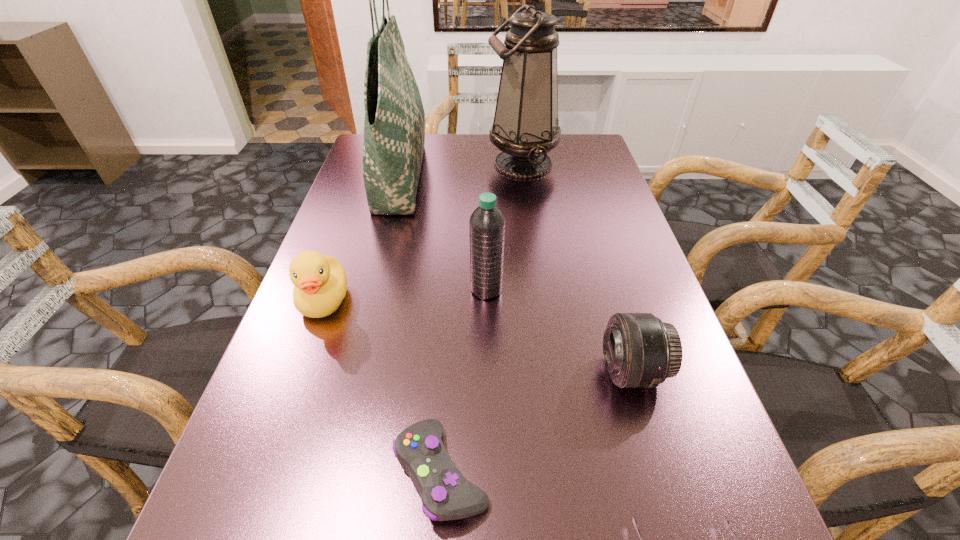
Identify the location of the tallest object. This screenshot has width=960, height=540. (394, 128).

Locate an element on the screen. The height and width of the screenshot is (540, 960). the sixth shortest object is located at coordinates (525, 128).

This screenshot has height=540, width=960. What are the coordinates of `water bottle` in the screenshot? It's located at (487, 223).

Identify the location of duck. Image resolution: width=960 pixels, height=540 pixels. (320, 281).

Where is `telephoto lens`? This screenshot has width=960, height=540. telephoto lens is located at coordinates (640, 351).

You are a GUI agent. You are given a task and a screenshot of the screen. Output one action in this format:
    pyautogui.click(x=<x>, y=<y>)
    Task: Click on the control
    
    Given the screenshot: What is the action you would take?
    pyautogui.click(x=446, y=494)

Locate an element on the screen. The image size is (960, 540). vacant space situated 0.270m on the right of the tote bag is located at coordinates (520, 174).

The image size is (960, 540). I want to click on free space located 0.300m on the left of the oil lamp, so click(385, 164).

Locate an element on the screen. The image size is (960, 540). blank space located 0.200m on the front of the water bottle is located at coordinates (488, 386).

Find the location of a particular element. free spot located 0.170m at the beak of the duck is located at coordinates (286, 407).